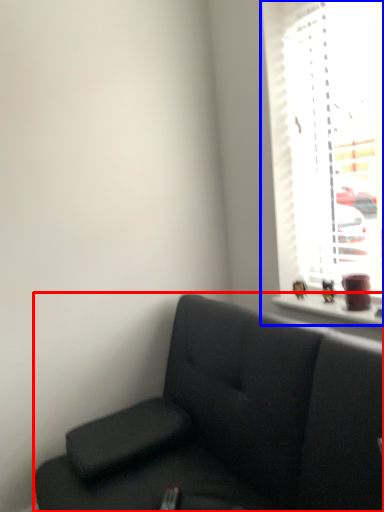
Question: Which of the following is the farthest to the observer, studio couch (highlighted by a red box) or window (highlighted by a blue box)?

Choices:
 (A) studio couch
 (B) window

Answer: (B)